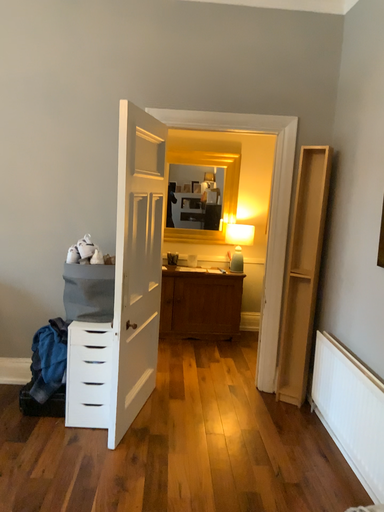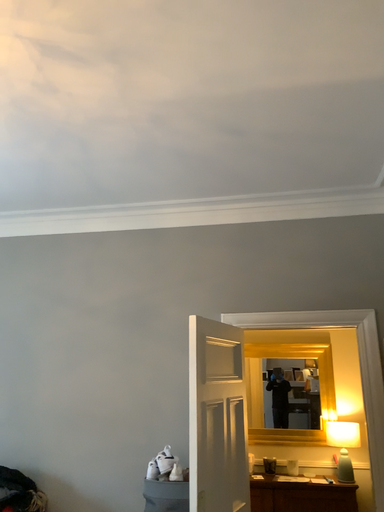
Question: Which way did the camera rotate in the video?

Choices:
 (A) rotated right
 (B) rotated left

Answer: (B)